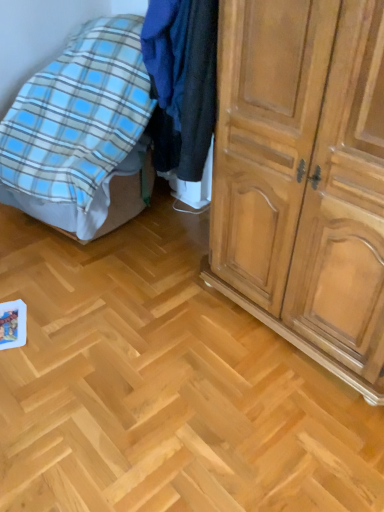
Question: Is blue plaid blanket at left facing towards light brown wooden cupboard at right?

Choices:
 (A) no
 (B) yes

Answer: (A)

Question: From the image's perspective, does blue plaid blanket at left appear lower than light brown wooden cupboard at right?

Choices:
 (A) yes
 (B) no

Answer: (B)

Question: Is blue plaid blanket at left to the left of light brown wooden cupboard at right from the viewer's perspective?

Choices:
 (A) no
 (B) yes

Answer: (B)

Question: Are blue plaid blanket at left and light brown wooden cupboard at right far apart?

Choices:
 (A) yes
 (B) no

Answer: (A)

Question: Can you confirm if blue plaid blanket at left is bigger than light brown wooden cupboard at right?

Choices:
 (A) no
 (B) yes

Answer: (B)

Question: Can you confirm if blue plaid blanket at left is thinner than light brown wooden cupboard at right?

Choices:
 (A) no
 (B) yes

Answer: (A)

Question: Does light brown wooden cupboard at right contain blue plaid blanket at left?

Choices:
 (A) yes
 (B) no

Answer: (B)

Question: Can you confirm if light brown wooden cupboard at right is smaller than blue plaid blanket at left?

Choices:
 (A) no
 (B) yes

Answer: (B)

Question: Does light brown wooden cupboard at right come behind blue plaid blanket at left?

Choices:
 (A) yes
 (B) no

Answer: (B)

Question: Is light brown wooden cupboard at right with blue plaid blanket at left?

Choices:
 (A) yes
 (B) no

Answer: (B)

Question: Is the depth of light brown wooden cupboard at right less than that of blue plaid blanket at left?

Choices:
 (A) yes
 (B) no

Answer: (A)

Question: Can you confirm if light brown wooden cupboard at right is wider than blue plaid blanket at left?

Choices:
 (A) no
 (B) yes

Answer: (A)

Question: Considering the positions of light brown wooden cupboard at right and blue plaid blanket at left in the image, is light brown wooden cupboard at right taller or shorter than blue plaid blanket at left?

Choices:
 (A) short
 (B) tall

Answer: (B)